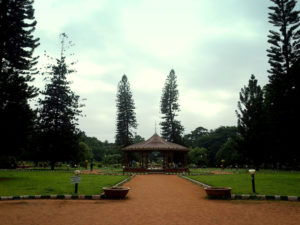
Find the location of a particular element. lamp is located at coordinates (76, 190).